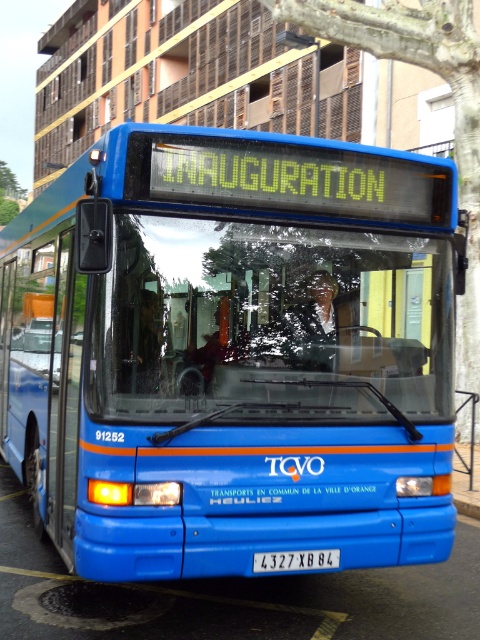
Who is positioned more to the right, blue matte bus at center or white plastic license plate at center?

Positioned to the right is blue matte bus at center.

Does point (249, 369) lie in front of point (256, 566)?

No, (249, 369) is behind (256, 566).

The width and height of the screenshot is (480, 640). Identify the location of blue matte bus at center. (232, 353).

Measure the distance between smooth bark tree at upper center and camera.

smooth bark tree at upper center and camera are 9.93 meters apart.

Does smooth bark tree at upper center appear under white plastic license plate at center?

Actually, smooth bark tree at upper center is above white plastic license plate at center.

You are a GUI agent. You are given a task and a screenshot of the screen. Output one action in this format:
    pyautogui.click(x=<x>, y=<y>)
    Task: Click on the smooth bark tree at upper center
    This screenshot has height=640, width=480.
    Given the screenshot: What is the action you would take?
    pyautogui.click(x=432, y=72)

This screenshot has width=480, height=640. Identify the location of smooth bark tree at upper center. (432, 72).

Which is in front, point (241, 404) or point (370, 260)?

Point (241, 404) is more forward.

Can you confirm if blue matte bus at center is positioned below transparent glass windshield at center?

No, blue matte bus at center is not below transparent glass windshield at center.

Measure the distance between point [325,448] and camera.

Point [325,448] and camera are 12.24 feet apart.

Locate an element on the screen. blue matte bus at center is located at coordinates pyautogui.click(x=232, y=353).